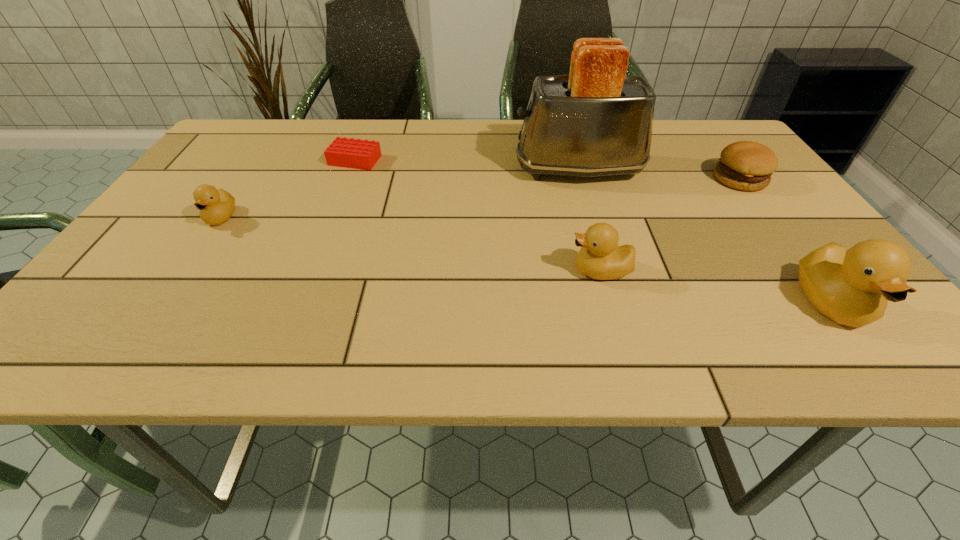
Identify the location of free spot located 0.120m on the face of the farthest duckling. (186, 269).

Locate an element on the screen. vacant region located on the face of the third tallest object is located at coordinates (493, 271).

Locate an element on the screen. The image size is (960, 540). vacant space located on the face of the third tallest object is located at coordinates (453, 271).

Image resolution: width=960 pixels, height=540 pixels. I want to click on free location located on the face of the third tallest object, so click(x=498, y=271).

Find the location of a particular element. The image size is (960, 540). free space located 0.300m on the side of the tallest object with the control lever is located at coordinates (398, 169).

This screenshot has width=960, height=540. In order to click on vacant space situated 0.110m on the side of the tallest object with the control lever in this screenshot , I will do `click(471, 169)`.

The width and height of the screenshot is (960, 540). I want to click on free space located 0.130m on the side of the tallest object with the control lever, so click(x=464, y=169).

At what (x,y) coordinates should I click in order to perform the action: click on vacant area situated 0.110m on the back of the hamburger. Please return your answer as a coordinate pair (x, y). This screenshot has height=540, width=960. Looking at the image, I should click on (713, 145).

At what (x,y) coordinates should I click in order to perform the action: click on free space located on the back of the fifth object from right to left. Please return your answer as a coordinate pair (x, y). Looking at the image, I should click on (364, 138).

Locate an element on the screen. The image size is (960, 540). toaster that is at the far edge is located at coordinates (x=597, y=121).